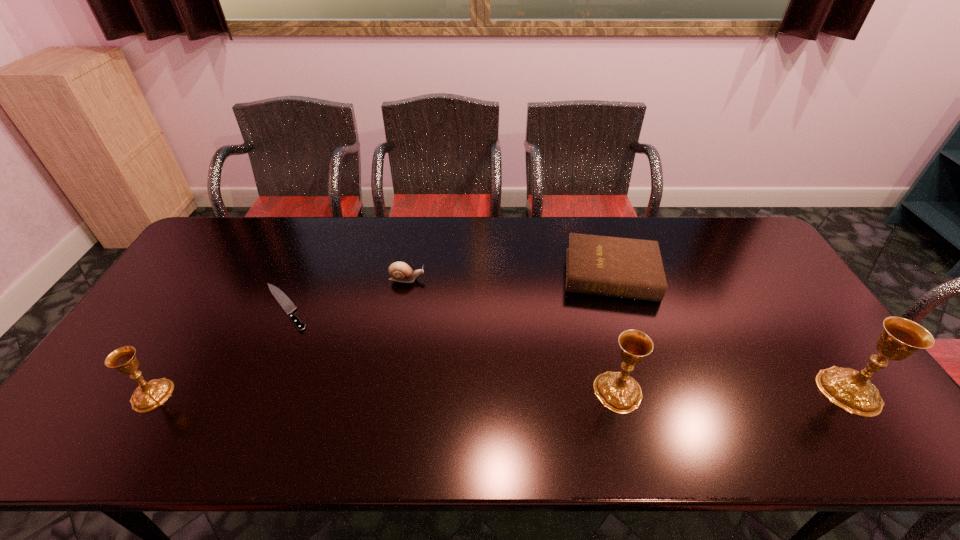
Where is `object at the near right corner`? The height and width of the screenshot is (540, 960). object at the near right corner is located at coordinates (852, 390).

In the image, there is a desktop. Identify the location of vacant space at the far edge. (300, 241).

You are a GUI agent. You are given a task and a screenshot of the screen. Output one action in this format:
    pyautogui.click(x=<x>, y=<y>)
    Task: Click on the vacant space at the near edge
    This screenshot has height=540, width=960.
    Given the screenshot: What is the action you would take?
    pyautogui.click(x=450, y=404)

Image resolution: width=960 pixels, height=540 pixels. Identify the location of vacant space at the left edge of the desktop. (171, 284).

Image resolution: width=960 pixels, height=540 pixels. Identify the location of vacant region at the right edge of the desktop. (772, 341).

Where is `vacant region at the near left corner of the desktop`? vacant region at the near left corner of the desktop is located at coordinates (103, 403).

Find the location of `vacant area that lies between the Bible and the second chalice from right to left`. vacant area that lies between the Bible and the second chalice from right to left is located at coordinates (614, 333).

Identify the location of free space between the steak knife and the tallest chalice. The image size is (960, 540). (567, 349).

You are a GUI agent. You are given a task and a screenshot of the screen. Output one action in this format:
    pyautogui.click(x=<x>, y=<y>)
    Task: Click on the empty location between the fifth object from right to left and the Bible
    The width and height of the screenshot is (960, 540).
    Given the screenshot: What is the action you would take?
    pyautogui.click(x=448, y=291)

Locate an element on the screen. The height and width of the screenshot is (540, 960). vacant region between the escargot and the shortest chalice is located at coordinates (279, 337).